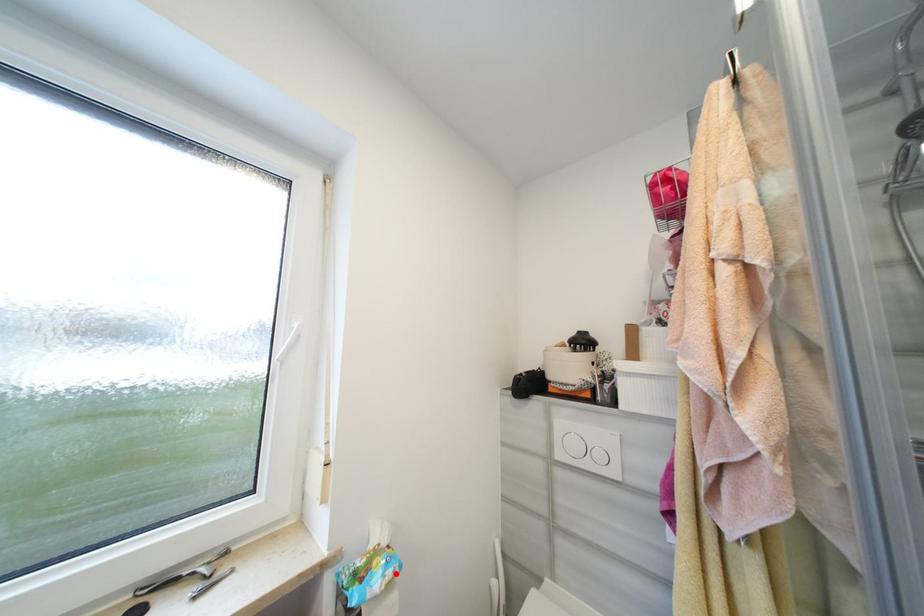
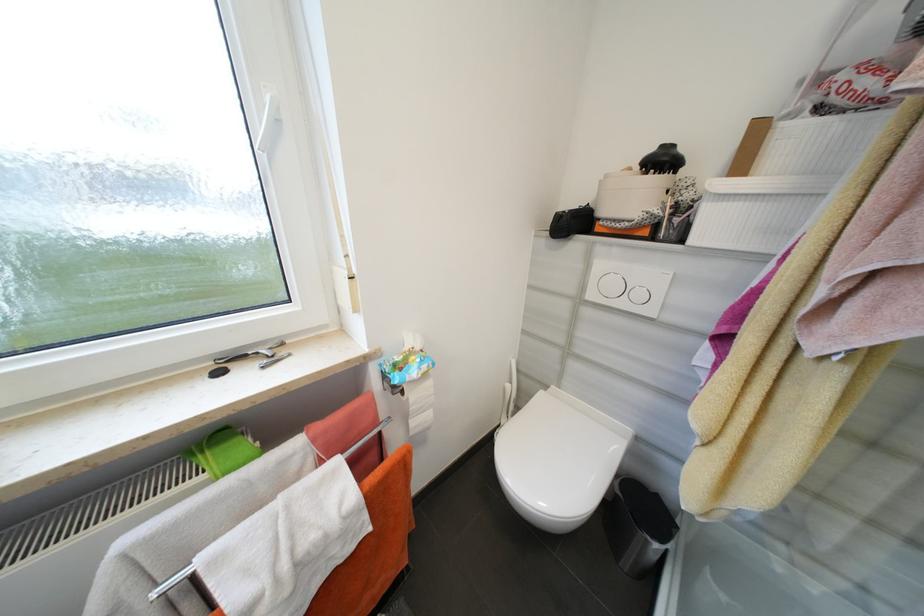
The point at the highlighted location is marked in the first image. Where is the corresponding point in the second image?

(430, 368)